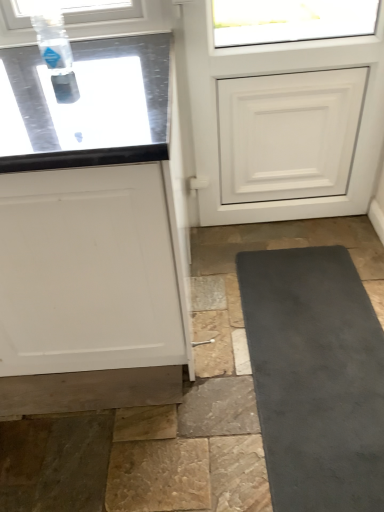
The height and width of the screenshot is (512, 384). Find the location of `free space in front of transparent plastic bottle at upper left`. free space in front of transparent plastic bottle at upper left is located at coordinates (46, 95).